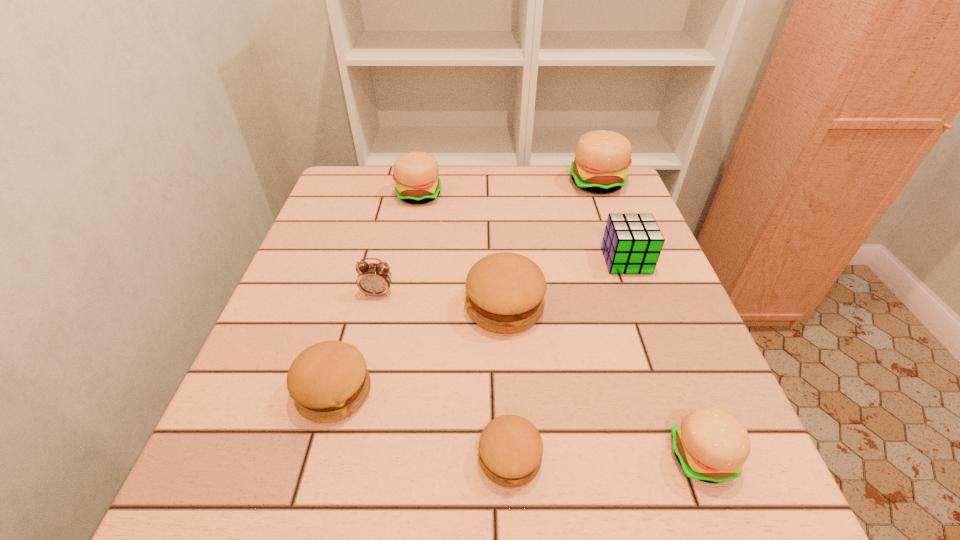
This screenshot has height=540, width=960. In order to click on the nearest beige hamburger in this screenshot , I will do `click(711, 445)`.

This screenshot has height=540, width=960. In order to click on the smallest brown hamburger in this screenshot , I will do `click(510, 450)`.

Where is `the nearest brown hamburger`? This screenshot has width=960, height=540. the nearest brown hamburger is located at coordinates (510, 450).

At what (x,y) coordinates should I click in order to perform the action: click on vacant space located on the front of the biggest beige hamburger. Please return your answer as a coordinate pair (x, y). The image size is (960, 540). Looking at the image, I should click on (614, 231).

This screenshot has height=540, width=960. What are the coordinates of `free space located on the front of the leftmost beige hamburger` in the screenshot? It's located at (396, 320).

Locate an element on the screen. Image resolution: width=960 pixels, height=540 pixels. free space located on the back of the farthest brown hamburger is located at coordinates [x=499, y=215].

Image resolution: width=960 pixels, height=540 pixels. I want to click on blank space located on the back of the cube, so (598, 184).

I want to click on free space located 0.310m on the face of the alarm clock, so click(x=344, y=436).

Image resolution: width=960 pixels, height=540 pixels. In order to click on free location located on the back of the second smallest brown hamburger in this screenshot , I will do `click(357, 310)`.

You are a GUI agent. You are given a task and a screenshot of the screen. Output one action in this format:
    pyautogui.click(x=<x>, y=<y>)
    Task: Click on the vacant space located 0.310m on the left of the nearest beige hamburger
    Image resolution: width=960 pixels, height=540 pixels.
    Given the screenshot: What is the action you would take?
    pyautogui.click(x=471, y=456)